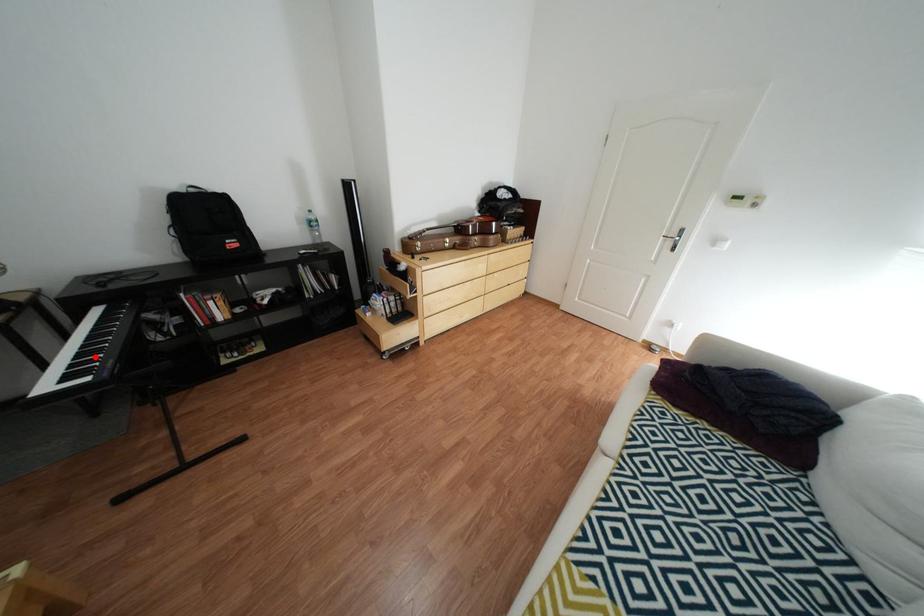
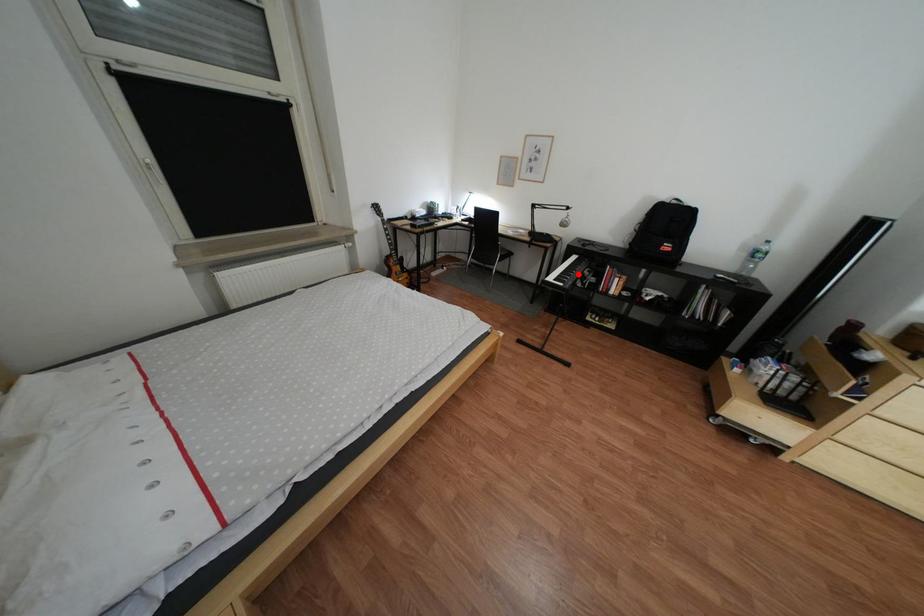
I am providing you with two images of the same scene from different viewpoints. A red point is marked on the first image and another point is marked on the second image. Is the marked point in image1 the same physical position as the marked point in image2?

Yes